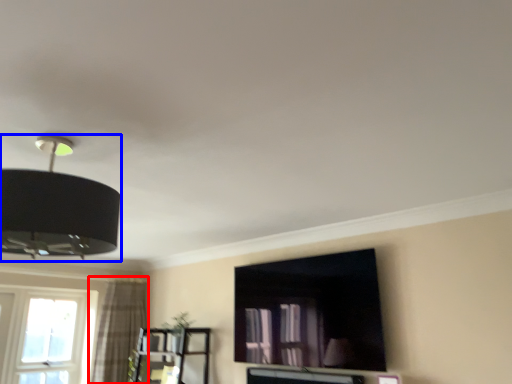
Question: Which object appears farthest to the camera in this image, curtain (highlighted by a red box) or lamp (highlighted by a blue box)?

Choices:
 (A) curtain
 (B) lamp

Answer: (A)